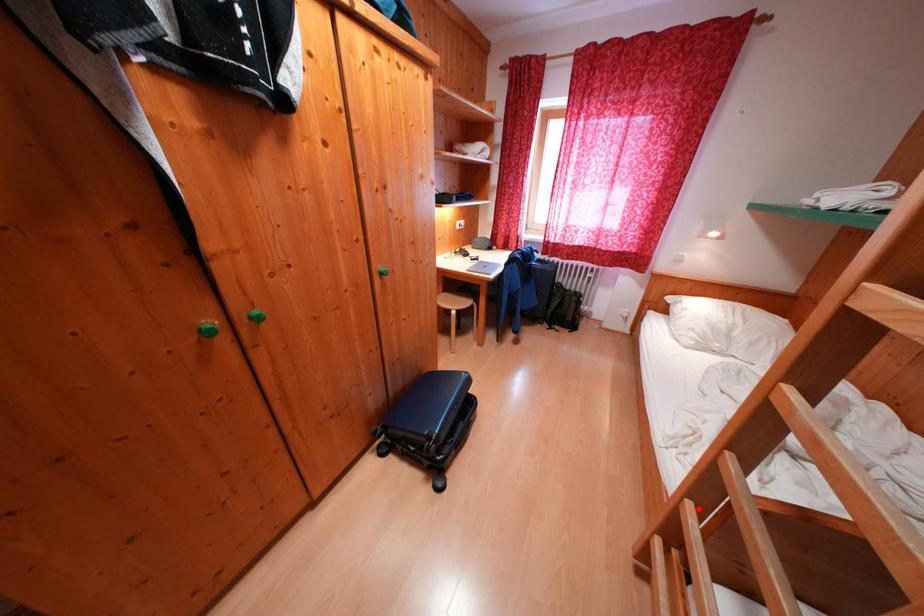
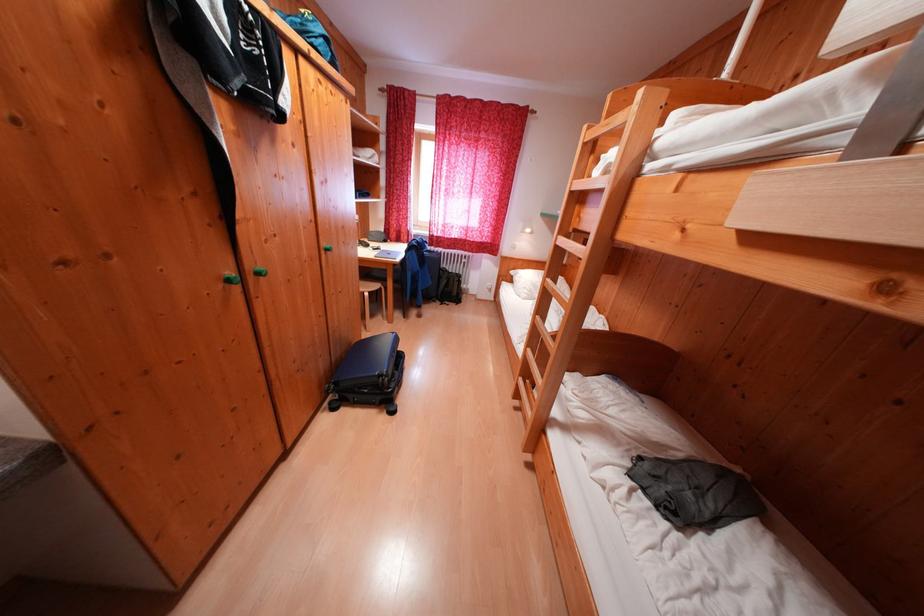
Question: I am providing you with two images of the same scene from different viewpoints. A red point is marked on the first image. Can you still see the location of the red point in image 2?

Choices:
 (A) Yes
 (B) No

Answer: (A)